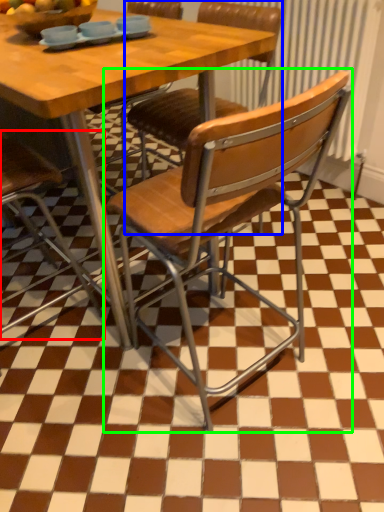
Question: Estimate the real-world distances between objects in this image. Which object is closer to chair (highlighted by a red box), chair (highlighted by a blue box) or chair (highlighted by a green box)?

Choices:
 (A) chair
 (B) chair

Answer: (B)